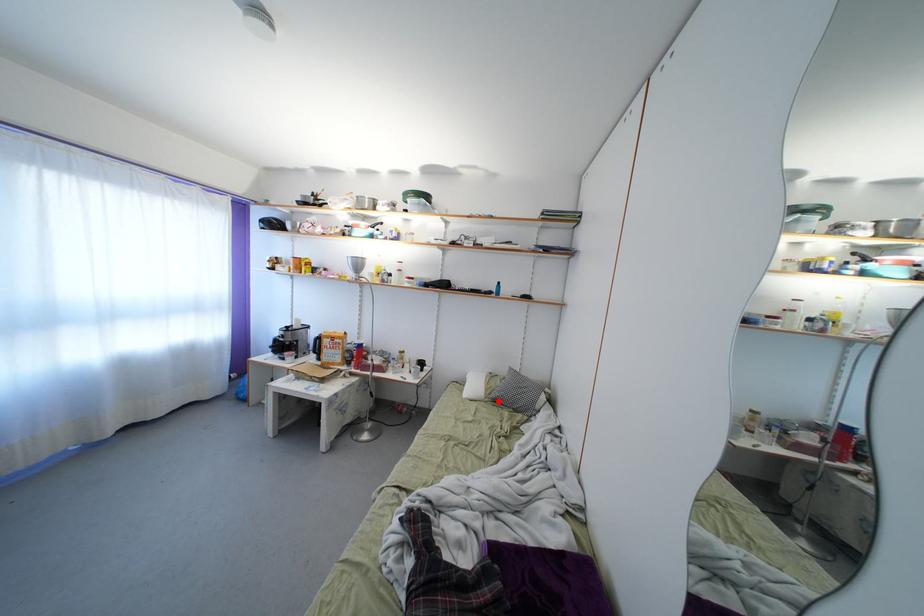
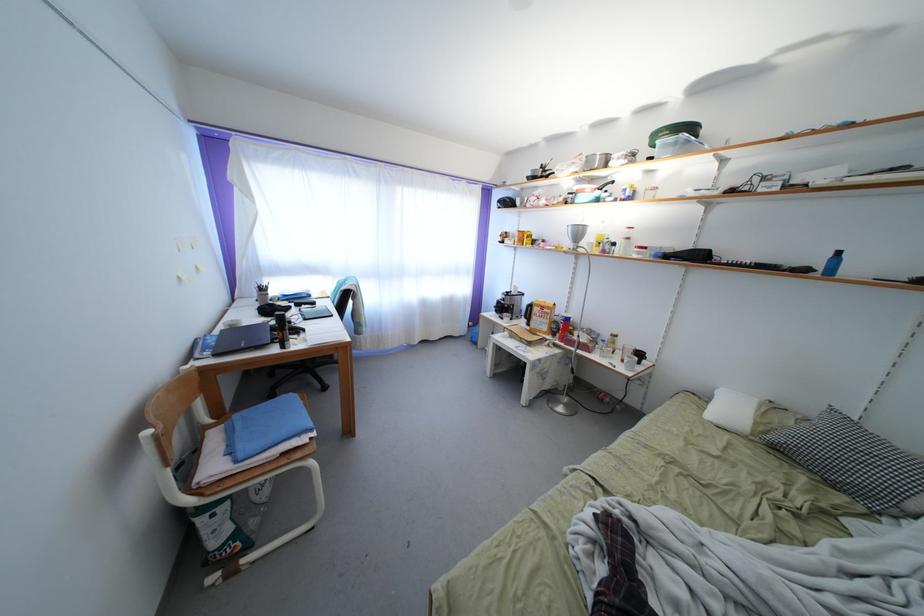
Where in the second image is the point corresponding to the highlighted location from the first image?

(779, 444)